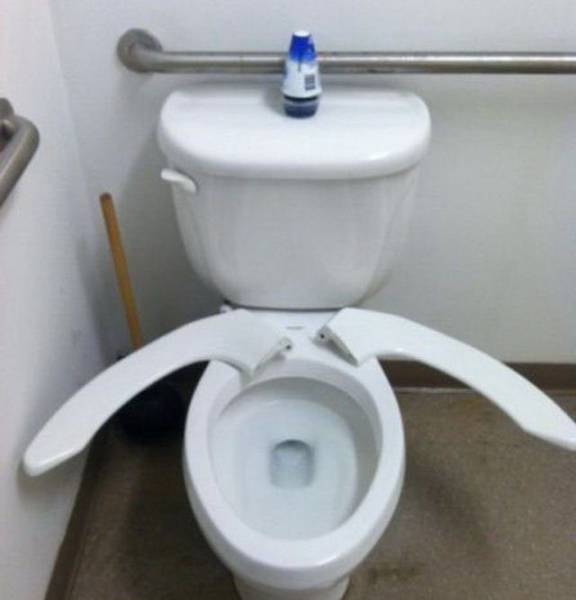
At what (x,y) coordinates should I click in order to perform the action: click on metallic support bars. Please return your answer as a coordinate pair (x, y). Looking at the image, I should click on pos(18,149), pos(502,64).